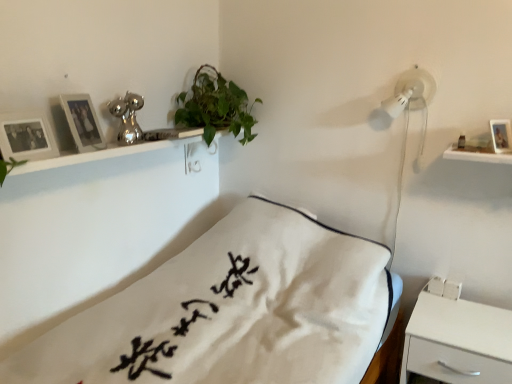
Locate an element on the screen. Image resolution: width=512 pixels, height=384 pixels. free spot above white matte nightstand at lower right (from a real-world perspective) is located at coordinates (471, 323).